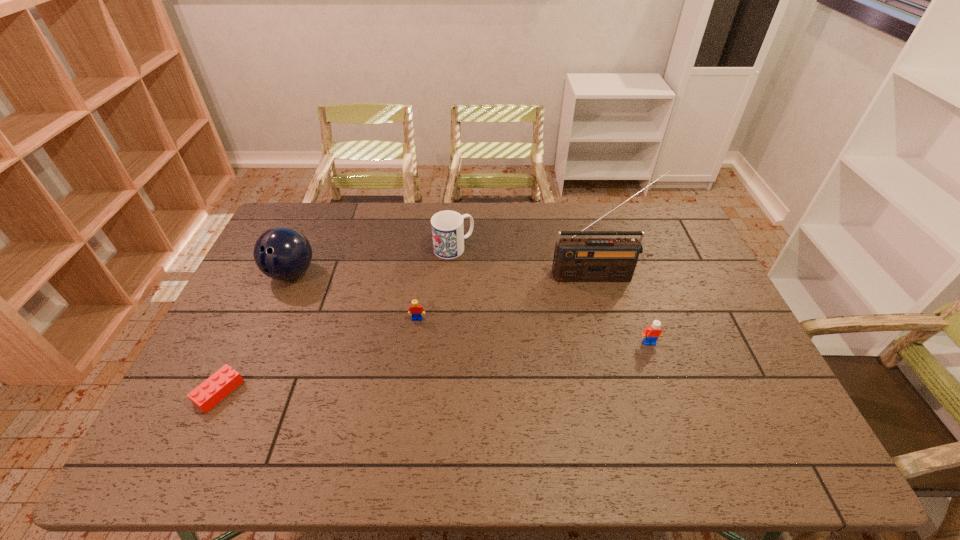
Locate an element on the screen. This screenshot has height=540, width=960. vacant space positioned 0.210m on the surface of the fifth shortest object near the finger holes is located at coordinates (259, 346).

In order to click on vacant space located 0.050m on the right of the third tallest object in this screenshot , I will do `click(488, 247)`.

You are a GUI agent. You are given a task and a screenshot of the screen. Output one action in this format:
    pyautogui.click(x=<x>, y=<y>)
    Task: Click on the vacant point located on the face of the second farthest Lego
    Image resolution: width=960 pixels, height=540 pixels.
    Given the screenshot: What is the action you would take?
    pyautogui.click(x=679, y=429)

The image size is (960, 540). Identify the location of blank space located 0.060m on the front-facing side of the farthest Lego. (415, 338).

At what (x,y) coordinates should I click in order to perform the action: click on vacant position located on the front of the nearest object. Please return your answer as a coordinate pair (x, y). The height and width of the screenshot is (540, 960). Looking at the image, I should click on (189, 453).

Locate an element on the screen. object present at the far edge is located at coordinates (447, 226).

At what (x,y) coordinates should I click in order to perform the action: click on bowling ball situated at the left edge. Please return your answer as a coordinate pair (x, y). This screenshot has width=960, height=540. Looking at the image, I should click on (282, 253).

At what (x,y) coordinates should I click in order to perform the action: click on Lego positioned at the left edge. Please return your answer as a coordinate pair (x, y). This screenshot has width=960, height=540. Looking at the image, I should click on (209, 393).

Locate an element on the screen. free spot at the far edge of the desktop is located at coordinates (588, 210).

Where is `free space at the near edge of the desktop`? free space at the near edge of the desktop is located at coordinates (733, 454).